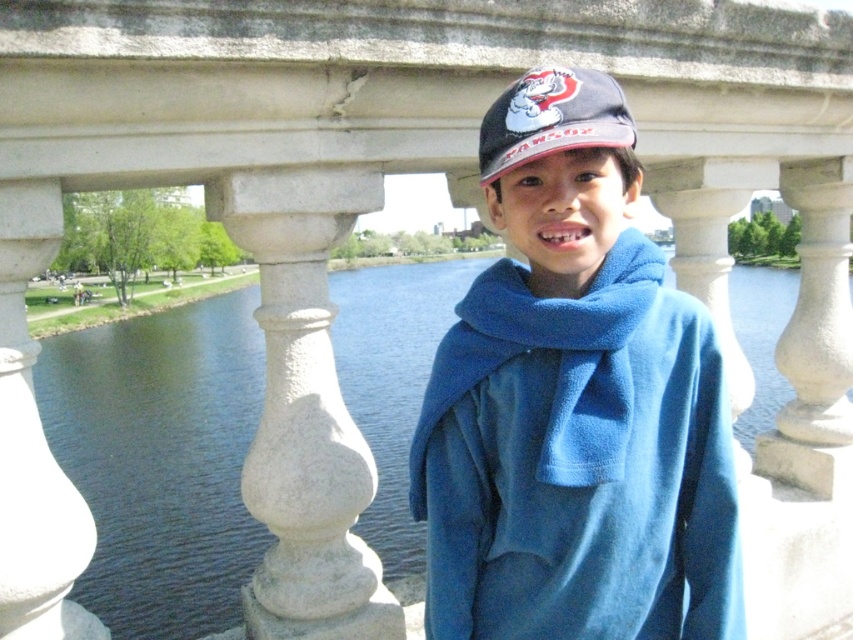
Question: Which object is positioned closest to the blue fleece scarf at center?

Choices:
 (A) blue fleece jacket at center
 (B) matte black cap at center

Answer: (A)

Question: Which of the following is the farthest from the observer?

Choices:
 (A) blue fleece jacket at center
 (B) blue fleece scarf at center

Answer: (B)

Question: In this image, where is blue fleece jacket at center located relative to blue fleece scarf at center?

Choices:
 (A) below
 (B) above

Answer: (B)

Question: Is blue fleece scarf at center positioned before matte black cap at center?

Choices:
 (A) no
 (B) yes

Answer: (A)

Question: Considering the relative positions of blue fleece jacket at center and matte black cap at center in the image provided, where is blue fleece jacket at center located with respect to matte black cap at center?

Choices:
 (A) above
 (B) below

Answer: (B)

Question: Among these objects, which one is farthest from the camera?

Choices:
 (A) matte black cap at center
 (B) blue fleece jacket at center
 (C) blue fleece scarf at center

Answer: (C)